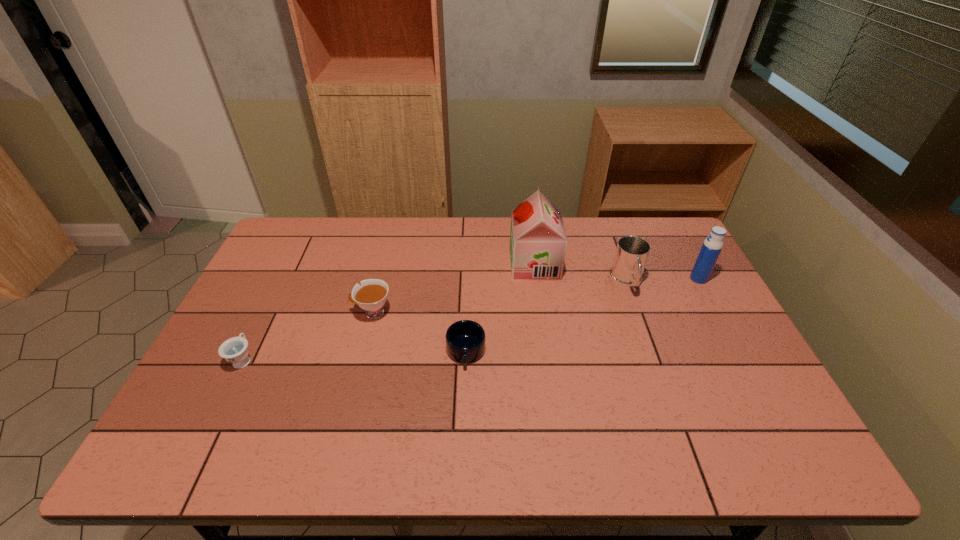
Find the location of a particular element. vacant space situated 0.250m on the side of the left teacup with the handle is located at coordinates (280, 283).

Image resolution: width=960 pixels, height=540 pixels. Find the location of `vacant region located on the side of the left teacup with the handle`. vacant region located on the side of the left teacup with the handle is located at coordinates (285, 275).

This screenshot has width=960, height=540. I want to click on vacant space located on the side of the left teacup with the handle, so click(262, 321).

This screenshot has width=960, height=540. I want to click on free location located with the handle on the side of the nearer mug, so click(x=465, y=392).

You are a GUI agent. You are given a task and a screenshot of the screen. Output one action in this format:
    pyautogui.click(x=<x>, y=<y>)
    Task: Click on the object that is at the far edge
    
    Given the screenshot: What is the action you would take?
    pyautogui.click(x=538, y=242)

Identify the location of object at the left edge. Image resolution: width=960 pixels, height=540 pixels. (235, 350).

Identify the location of object located at the right edge. (713, 244).

Find the location of a particular element. free space at the far edge of the desktop is located at coordinates (482, 233).

The image size is (960, 540). In the image, there is a desktop. Identify the location of free space at the near edge. (245, 459).

Locate an element on the screen. This screenshot has height=540, width=960. free region at the left edge of the desktop is located at coordinates (266, 349).